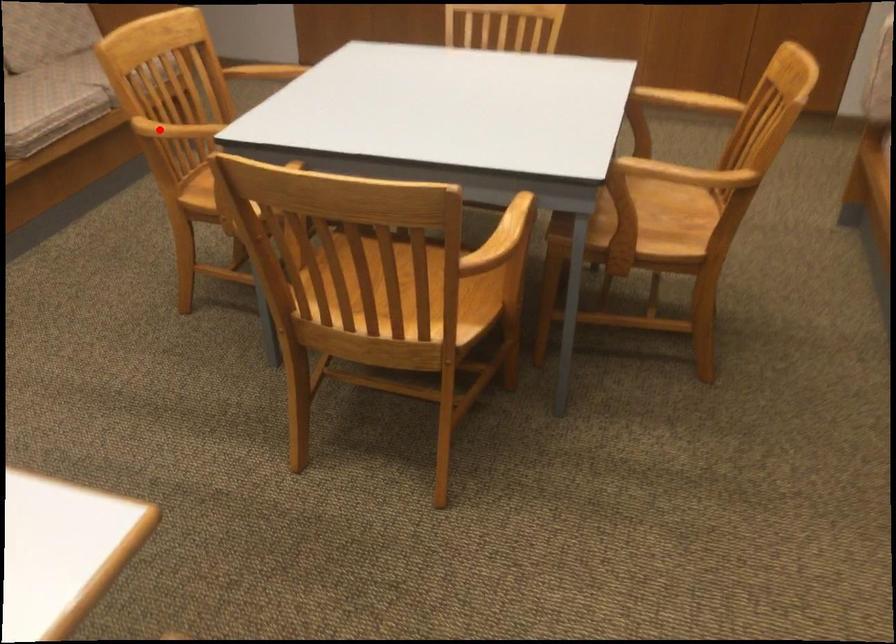
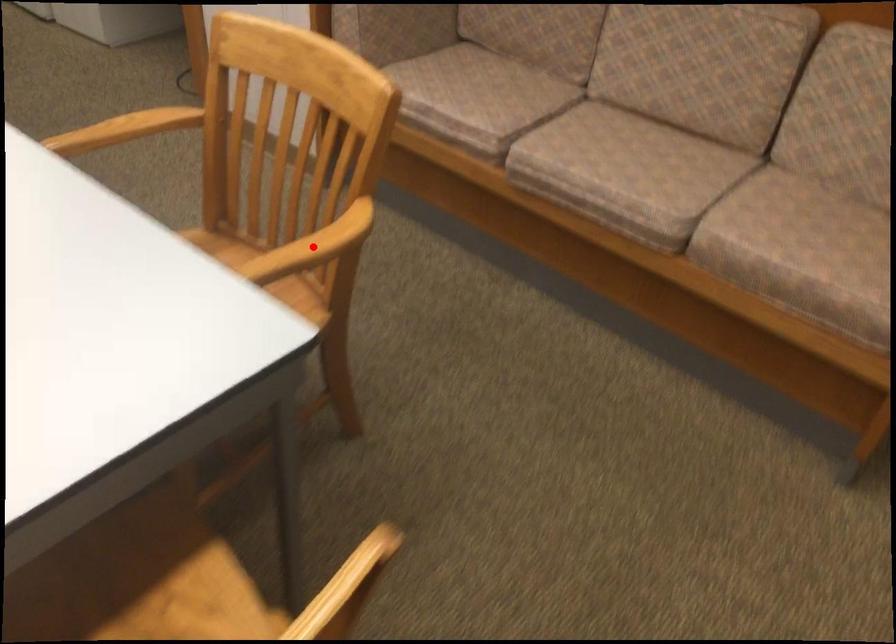
I am providing you with two images of the same scene from different viewpoints. A red point is marked on the first image and another point is marked on the second image. Are the points marked in image1 and image2 representing the same 3D position?

No